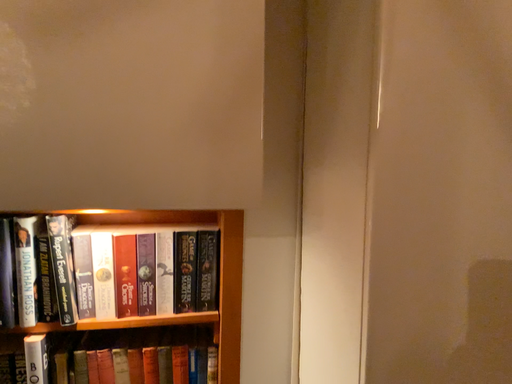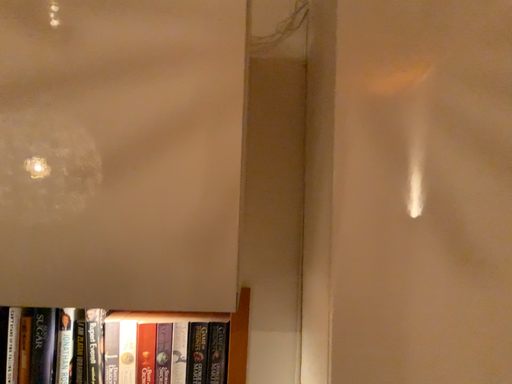
Question: Which way did the camera rotate in the video?

Choices:
 (A) rotated downward
 (B) rotated upward

Answer: (B)